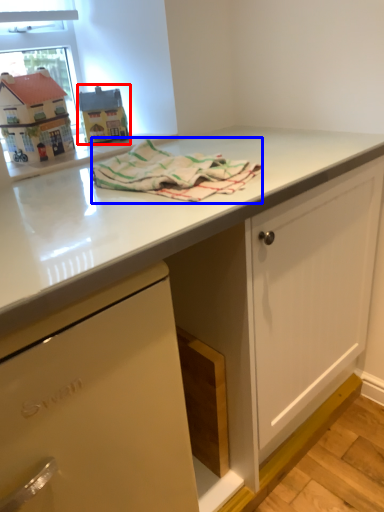
Question: Which object is closer to the camera taking this photo, appliance (highlighted by a red box) or bath towel (highlighted by a blue box)?

Choices:
 (A) appliance
 (B) bath towel

Answer: (B)